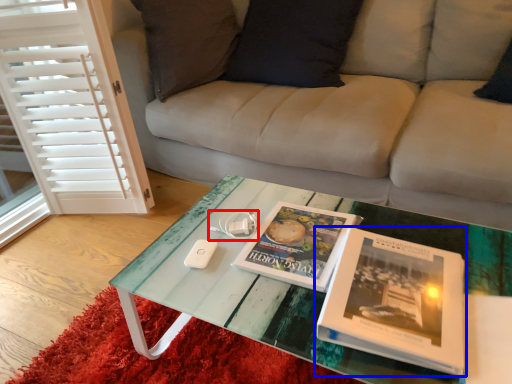
Question: Which point is closer to the camera, game controller (highlighted by a red box) or book (highlighted by a blue box)?

Choices:
 (A) game controller
 (B) book

Answer: (B)